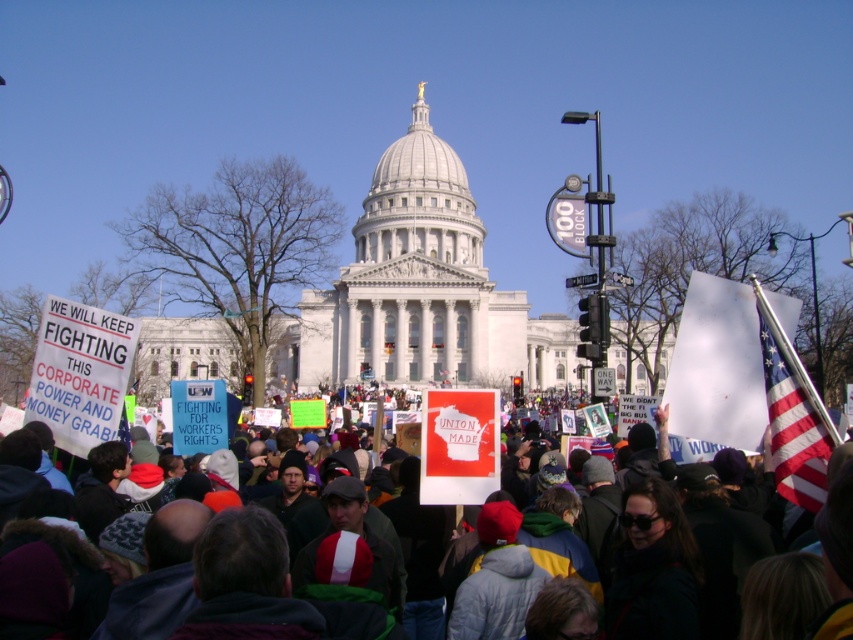
Question: Can you confirm if white paper sign at center is positioned above american flag at right?

Choices:
 (A) no
 (B) yes

Answer: (A)

Question: Which of the following is the closest to the observer?

Choices:
 (A) american flag at right
 (B) white paper sign at center

Answer: (B)

Question: Can you confirm if white paper sign at center is thinner than american flag at right?

Choices:
 (A) no
 (B) yes

Answer: (A)

Question: Is white paper sign at center behind american flag at right?

Choices:
 (A) yes
 (B) no

Answer: (B)